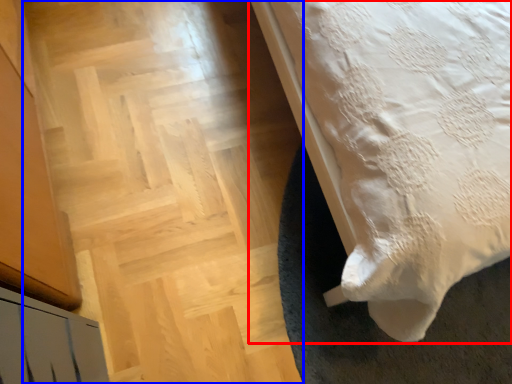
Question: Which point is closer to the camera, bed (highlighted by a red box) or stairwell (highlighted by a blue box)?

Choices:
 (A) bed
 (B) stairwell

Answer: (A)